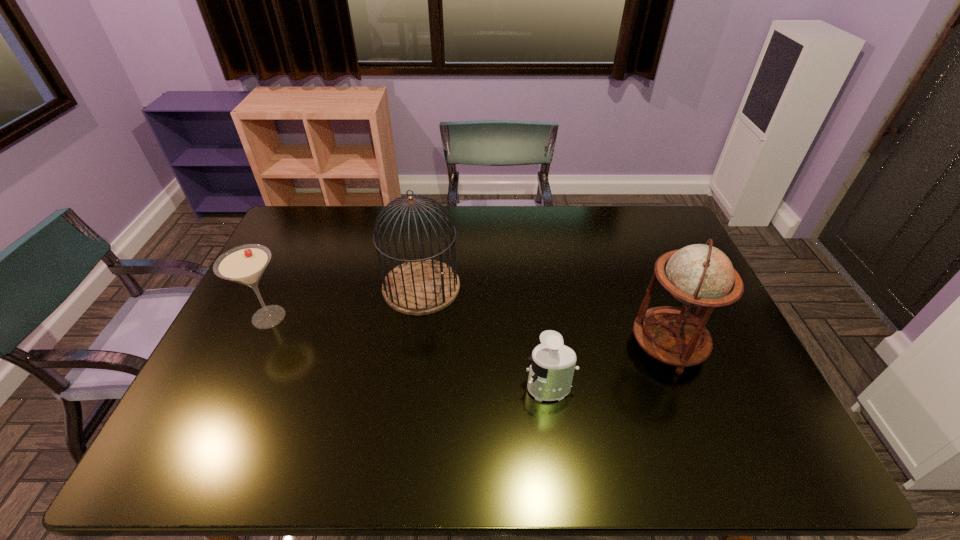
Identify the location of object that is the second nearest to the juicer. (417, 287).

What are the coordinates of `free space that satisfies the following two spatial constraints: 1. at the door of the shortest object; 2. on the left side of the second object from left to right` in the screenshot? It's located at (407, 388).

Identify the location of free spot that satisfies the following two spatial constraints: 1. on the back side of the second object from right to left; 2. at the door of the third object from right to left. (536, 287).

This screenshot has height=540, width=960. I want to click on free location that satisfies the following two spatial constraints: 1. on the back side of the third object from left to right; 2. at the door of the second object from left to right, so tap(536, 287).

The height and width of the screenshot is (540, 960). I want to click on vacant area that satisfies the following two spatial constraints: 1. at the door of the birdcage; 2. on the back side of the juicer, so click(x=407, y=388).

Where is `free location that satisfies the following two spatial constraints: 1. at the door of the second object from left to right; 2. on the left side of the second object from right to left`? free location that satisfies the following two spatial constraints: 1. at the door of the second object from left to right; 2. on the left side of the second object from right to left is located at coordinates (407, 388).

The width and height of the screenshot is (960, 540). Find the location of `vacant space that satisfies the following two spatial constraints: 1. on the back side of the juicer; 2. at the door of the second object from left to right`. vacant space that satisfies the following two spatial constraints: 1. on the back side of the juicer; 2. at the door of the second object from left to right is located at coordinates (536, 287).